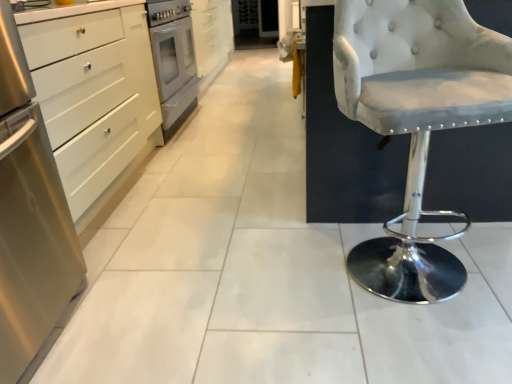
What do you see at coordinates (173, 61) in the screenshot? I see `stainless steel oven at center-left` at bounding box center [173, 61].

The width and height of the screenshot is (512, 384). What do you see at coordinates (416, 119) in the screenshot?
I see `white tufted fabric stool at right` at bounding box center [416, 119].

I want to click on white glossy cabinet at upper left, placed as the first cabinetry when sorted from top to bottom, so click(x=212, y=36).

Find the location of `stainless steel cabinet at left, which is the first cabinetry from left to right`. stainless steel cabinet at left, which is the first cabinetry from left to right is located at coordinates click(x=94, y=96).

Considering the relative positions of stainless steel oven at center-left and stainless steel cabinet at left, which appears as the first cabinetry when ordered from the bottom, in the image provided, is stainless steel oven at center-left to the left of stainless steel cabinet at left, which appears as the first cabinetry when ordered from the bottom, from the viewer's perspective?

In fact, stainless steel oven at center-left is to the right of stainless steel cabinet at left, which appears as the first cabinetry when ordered from the bottom.

Which is more distant, [168,6] or [98,206]?

The point [168,6] is more distant.

Between stainless steel oven at center-left and stainless steel cabinet at left, which is the first cabinetry from left to right, which one has larger size?

With larger size is stainless steel cabinet at left, which is the first cabinetry from left to right.

Is the surface of stainless steel oven at center-left in direct contact with white glossy cabinet at upper left, the second cabinetry when ordered from bottom to top?

No, stainless steel oven at center-left is not touching white glossy cabinet at upper left, the second cabinetry when ordered from bottom to top.

In terms of width, does stainless steel oven at center-left look wider or thinner when compared to white glossy cabinet at upper left, the second cabinetry when ordered from bottom to top?

stainless steel oven at center-left is wider than white glossy cabinet at upper left, the second cabinetry when ordered from bottom to top.

From a real-world perspective, is stainless steel oven at center-left on white glossy cabinet at upper left, which is the first cabinetry in back-to-front order?

Yes, from a real-world perspective, stainless steel oven at center-left is over white glossy cabinet at upper left, which is the first cabinetry in back-to-front order

Where is `home appliance located on the left of white glossy cabinet at upper left, the 1th cabinetry from the right`? The height and width of the screenshot is (384, 512). home appliance located on the left of white glossy cabinet at upper left, the 1th cabinetry from the right is located at coordinates (173, 61).

Is stainless steel cabinet at left, which is the first cabinetry from front to back, oriented towards white tufted fabric stool at right?

Yes.

From the image's perspective, which one is positioned higher, stainless steel cabinet at left, which is the second cabinetry in top-to-bottom order, or white tufted fabric stool at right?

stainless steel cabinet at left, which is the second cabinetry in top-to-bottom order.

From a real-world perspective, between stainless steel cabinet at left, which is the first cabinetry from left to right, and white tufted fabric stool at right, who is vertically higher?

white tufted fabric stool at right.

Is stainless steel cabinet at left, which is the first cabinetry from front to back, taller than white tufted fabric stool at right?

Indeed, stainless steel cabinet at left, which is the first cabinetry from front to back, has a greater height compared to white tufted fabric stool at right.

Would you consider white glossy cabinet at upper left, the 2th cabinetry viewed from the front, to be distant from stainless steel cabinet at left, which is the second cabinetry in back-to-front order?

white glossy cabinet at upper left, the 2th cabinetry viewed from the front, is positioned a significant distance from stainless steel cabinet at left, which is the second cabinetry in back-to-front order.

Considering the positions of objects white glossy cabinet at upper left, placed as the first cabinetry when sorted from top to bottom, and stainless steel cabinet at left, which is the first cabinetry from left to right, in the image provided, who is more to the left, white glossy cabinet at upper left, placed as the first cabinetry when sorted from top to bottom, or stainless steel cabinet at left, which is the first cabinetry from left to right,?

From the viewer's perspective, stainless steel cabinet at left, which is the first cabinetry from left to right, appears more on the left side.

Is white glossy cabinet at upper left, placed as the first cabinetry when sorted from top to bottom, wider than stainless steel cabinet at left, which is the first cabinetry from left to right?

No.

Is white glossy cabinet at upper left, placed as the first cabinetry when sorted from top to bottom, in front of stainless steel cabinet at left, which is the second cabinetry in top-to-bottom order?

That is False.

Is point (113, 174) closer or farther from the camera than point (220, 64)?

Clearly, point (113, 174) is closer to the camera than point (220, 64).

From the image's perspective, is stainless steel cabinet at left, the 2th cabinetry in the right-to-left sequence, positioned above or below white glossy cabinet at upper left, the second cabinetry positioned from the left?

stainless steel cabinet at left, the 2th cabinetry in the right-to-left sequence, is below white glossy cabinet at upper left, the second cabinetry positioned from the left.

Is stainless steel cabinet at left, which is the second cabinetry in top-to-bottom order, bigger than white glossy cabinet at upper left, the second cabinetry when ordered from bottom to top?

Yes.

Is the position of stainless steel cabinet at left, which is the first cabinetry from left to right, more distant than that of white glossy cabinet at upper left, which is the first cabinetry in back-to-front order?

No, it is in front of white glossy cabinet at upper left, which is the first cabinetry in back-to-front order.

Which object is closer to the camera taking this photo, stainless steel cabinet at left, which is the second cabinetry in back-to-front order, or stainless steel oven at center-left?

stainless steel cabinet at left, which is the second cabinetry in back-to-front order, is more forward.

Is stainless steel cabinet at left, which is the first cabinetry from front to back, positioned with its back to stainless steel oven at center-left?

No.

Which object is positioned more to the left, stainless steel cabinet at left, which appears as the first cabinetry when ordered from the bottom, or stainless steel oven at center-left?

Positioned to the left is stainless steel cabinet at left, which appears as the first cabinetry when ordered from the bottom.

Based on the photo, considering their positions, is white tufted fabric stool at right located in front of or behind stainless steel oven at center-left?

Visually, white tufted fabric stool at right is located in front of stainless steel oven at center-left.

Between point (453, 119) and point (157, 27), which one is positioned behind?

The point (157, 27) is farther.

Does white tufted fabric stool at right turn towards stainless steel oven at center-left?

No, white tufted fabric stool at right is not turned towards stainless steel oven at center-left.

Is white tufted fabric stool at right completely or partially outside of stainless steel oven at center-left?

Absolutely, white tufted fabric stool at right is external to stainless steel oven at center-left.

Where is `home appliance that appears below the stainless steel cabinet at left, the 2th cabinetry in the right-to-left sequence (from a real-world perspective)`? This screenshot has height=384, width=512. home appliance that appears below the stainless steel cabinet at left, the 2th cabinetry in the right-to-left sequence (from a real-world perspective) is located at coordinates (173, 61).

Identify the location of cabinetry located above the stainless steel oven at center-left (from the image's perspective). The height and width of the screenshot is (384, 512). (212, 36).

Considering their positions, is stainless steel cabinet at left, which is the first cabinetry from left to right, positioned further to white glossy cabinet at upper left, placed as the first cabinetry when sorted from top to bottom, than white tufted fabric stool at right?

Among the two, white tufted fabric stool at right is located further to white glossy cabinet at upper left, placed as the first cabinetry when sorted from top to bottom.

Estimate the real-world distances between objects in this image. Which object is closer to white glossy cabinet at upper left, which is the first cabinetry in back-to-front order, stainless steel cabinet at left, which appears as the first cabinetry when ordered from the bottom, or stainless steel oven at center-left?

Based on the image, stainless steel oven at center-left appears to be nearer to white glossy cabinet at upper left, which is the first cabinetry in back-to-front order.

Based on their spatial positions, is stainless steel cabinet at left, the 2th cabinetry in the right-to-left sequence, or white tufted fabric stool at right further from stainless steel oven at center-left?

white tufted fabric stool at right lies further to stainless steel oven at center-left than the other object.

Considering their positions, is stainless steel oven at center-left positioned further to white tufted fabric stool at right than white glossy cabinet at upper left, the second cabinetry when ordered from bottom to top?

Based on the image, white glossy cabinet at upper left, the second cabinetry when ordered from bottom to top, appears to be further to white tufted fabric stool at right.

In the scene shown: Looking at the image, which one is located further to stainless steel oven at center-left, white glossy cabinet at upper left, the second cabinetry when ordered from bottom to top, or white tufted fabric stool at right?

Among the two, white tufted fabric stool at right is located further to stainless steel oven at center-left.

Considering their positions, is white glossy cabinet at upper left, the 1th cabinetry from the right, positioned further to white tufted fabric stool at right than stainless steel oven at center-left?

white glossy cabinet at upper left, the 1th cabinetry from the right.

Looking at this image, when comparing their distances from white glossy cabinet at upper left, the second cabinetry when ordered from bottom to top, does white tufted fabric stool at right or stainless steel cabinet at left, which is the second cabinetry in top-to-bottom order, seem closer?

stainless steel cabinet at left, which is the second cabinetry in top-to-bottom order, is positioned closer to the anchor white glossy cabinet at upper left, the second cabinetry when ordered from bottom to top.

Considering their positions, is stainless steel oven at center-left positioned further to white tufted fabric stool at right than stainless steel cabinet at left, the 2th cabinetry in the right-to-left sequence?

stainless steel oven at center-left lies further to white tufted fabric stool at right than the other object.

Where is `cabinetry between white tufted fabric stool at right and stainless steel oven at center-left along the z-axis`? Image resolution: width=512 pixels, height=384 pixels. cabinetry between white tufted fabric stool at right and stainless steel oven at center-left along the z-axis is located at coordinates (94, 96).

The image size is (512, 384). In order to click on home appliance positioned between white tufted fabric stool at right and white glossy cabinet at upper left, which is the first cabinetry in back-to-front order, from near to far in this screenshot , I will do `click(173, 61)`.

This screenshot has width=512, height=384. Find the location of `home appliance located between stainless steel cabinet at left, which appears as the first cabinetry when ordered from the bottom, and white glossy cabinet at upper left, which is the first cabinetry in back-to-front order, in the depth direction`. home appliance located between stainless steel cabinet at left, which appears as the first cabinetry when ordered from the bottom, and white glossy cabinet at upper left, which is the first cabinetry in back-to-front order, in the depth direction is located at coordinates (173, 61).

Image resolution: width=512 pixels, height=384 pixels. Find the location of `cabinetry positioned between white tufted fabric stool at right and white glossy cabinet at upper left, the second cabinetry positioned from the left, from near to far`. cabinetry positioned between white tufted fabric stool at right and white glossy cabinet at upper left, the second cabinetry positioned from the left, from near to far is located at coordinates 94,96.